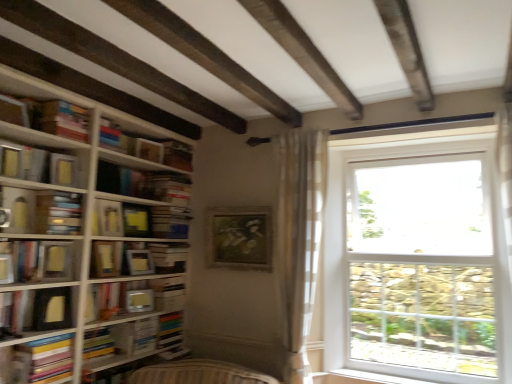
Question: Is matte yellow paperback at center-left, marked as the fourth paperback book in a bottom-to-top arrangement, far from white matte paperback book at center, the eighth paperback book positioned from the top?

Choices:
 (A) yes
 (B) no

Answer: (B)

Question: Does matte yellow paperback at center-left, marked as the fourth paperback book in a bottom-to-top arrangement, have a lesser width compared to white matte paperback book at center, the eighth paperback book positioned from the top?

Choices:
 (A) no
 (B) yes

Answer: (B)

Question: Is matte yellow paperback at center-left, which appears as the 6th paperback book when viewed from the top, positioned in front of white matte paperback book at center, the second paperback book from the bottom?

Choices:
 (A) yes
 (B) no

Answer: (A)

Question: Is white matte paperback book at center, the second paperback book from the bottom, a part of matte yellow paperback at center-left, marked as the fourth paperback book in a bottom-to-top arrangement?

Choices:
 (A) no
 (B) yes

Answer: (A)

Question: Is matte yellow paperback at center-left, marked as the fourth paperback book in a bottom-to-top arrangement, completely or partially outside of white matte paperback book at center, the second paperback book from the bottom?

Choices:
 (A) yes
 (B) no

Answer: (A)

Question: Is matte yellow paperback at center-left, marked as the fourth paperback book in a bottom-to-top arrangement, shorter than white matte paperback book at center, the eighth paperback book positioned from the top?

Choices:
 (A) yes
 (B) no

Answer: (B)

Question: From a real-world perspective, is matte yellow book at left, which is the 4th book in bottom-to-top order, physically below yellow matte paper at center, which is the 6th paperback book from bottom to top?

Choices:
 (A) yes
 (B) no

Answer: (B)

Question: Is matte yellow book at left, which is the 1th book in top-to-bottom order, shorter than yellow matte paper at center, positioned as the fourth paperback book in top-to-bottom order?

Choices:
 (A) no
 (B) yes

Answer: (B)

Question: Is matte yellow book at left, which is the 4th book in bottom-to-top order, outside yellow matte paper at center, positioned as the fourth paperback book in top-to-bottom order?

Choices:
 (A) no
 (B) yes

Answer: (B)

Question: Is yellow matte paper at center, positioned as the fourth paperback book in top-to-bottom order, located within matte yellow book at left, which is the 4th book in bottom-to-top order?

Choices:
 (A) no
 (B) yes

Answer: (A)

Question: Is matte yellow book at left, which is the 1th book in top-to-bottom order, closer to the viewer compared to yellow matte paper at center, which is the 6th paperback book from bottom to top?

Choices:
 (A) yes
 (B) no

Answer: (A)

Question: Considering the relative sizes of matte yellow book at left, which is the 1th book in top-to-bottom order, and yellow matte paper at center, which is the 6th paperback book from bottom to top, in the image provided, is matte yellow book at left, which is the 1th book in top-to-bottom order, bigger than yellow matte paper at center, which is the 6th paperback book from bottom to top,?

Choices:
 (A) yes
 (B) no

Answer: (A)

Question: Does white plastic window sill at lower right lie in front of hardcover book at center-left, acting as the 2th book starting from the top?

Choices:
 (A) no
 (B) yes

Answer: (B)